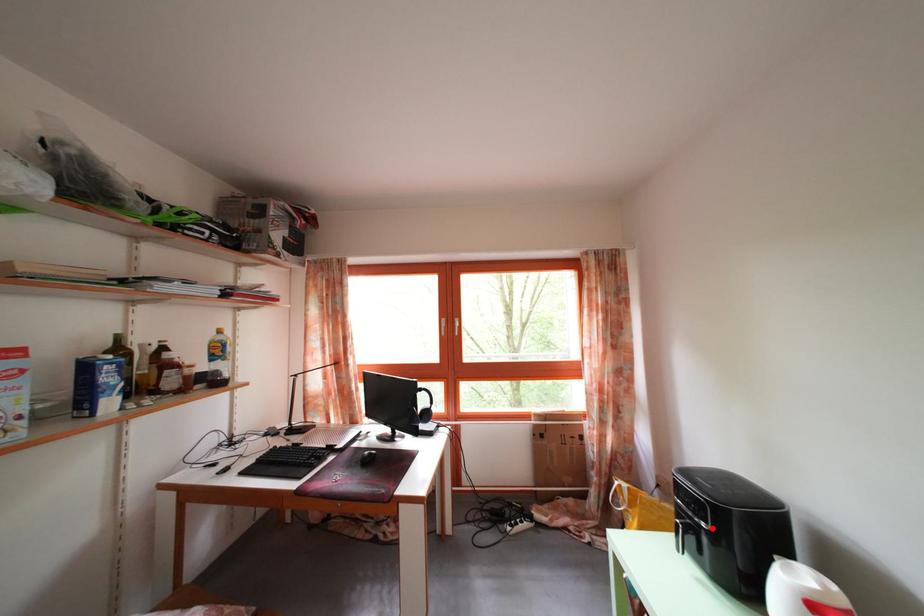
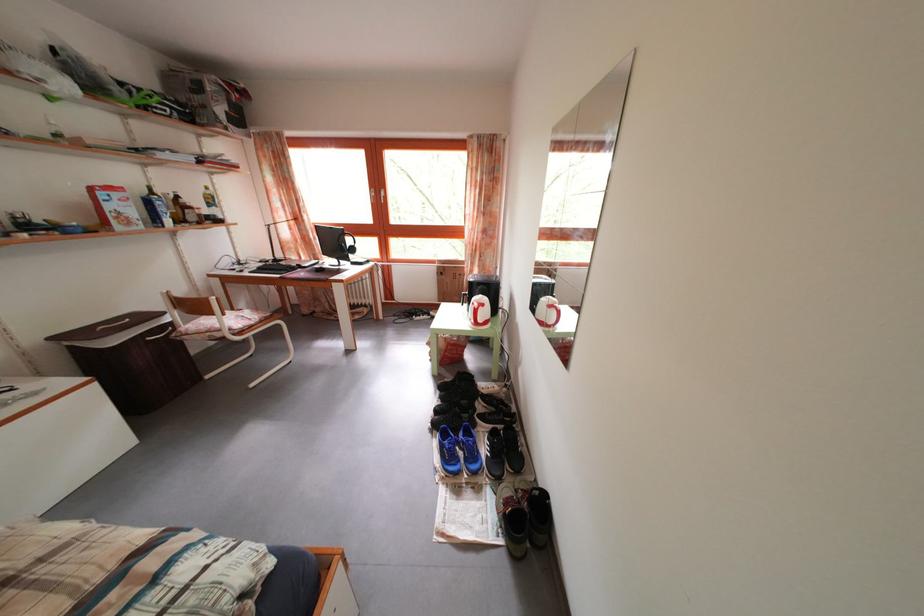
Question: I am providing you with two images of the same scene from different viewpoints. A red point is marked on the first image. Can you still see the location of the red point in image 2?

Choices:
 (A) Yes
 (B) No

Answer: (B)